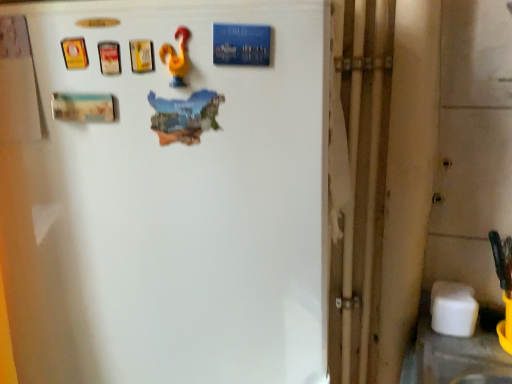
You are a GUI agent. You are given a task and a screenshot of the screen. Output one action in this format:
    pyautogui.click(x=<x>, y=<y>)
    Task: Click on the yellow rubber rooster at upper center
    The height and width of the screenshot is (384, 512).
    Given the screenshot: What is the action you would take?
    pyautogui.click(x=177, y=57)

What do you see at coordinates (177, 57) in the screenshot?
I see `yellow rubber rooster at upper center` at bounding box center [177, 57].

What is the approximate height of yellow rubber rooster at upper center?

yellow rubber rooster at upper center is 3.61 inches tall.

The width and height of the screenshot is (512, 384). Identify the location of white glossy refrigerator at upper center. (165, 191).

Consider the image. Measure the distance between point (141, 308) and camera.

Point (141, 308) and camera are 27.24 inches apart.

This screenshot has width=512, height=384. Describe the element at coordinates (165, 191) in the screenshot. I see `white glossy refrigerator at upper center` at that location.

Identify the location of yellow rubber rooster at upper center. (177, 57).

Is white glossy refrigerator at upper center to the right of yellow rubber rooster at upper center from the viewer's perspective?

No, white glossy refrigerator at upper center is not to the right of yellow rubber rooster at upper center.

Considering their positions, is white glossy refrigerator at upper center located in front of or behind yellow rubber rooster at upper center?

Visually, white glossy refrigerator at upper center is located in front of yellow rubber rooster at upper center.

Does point (189, 67) lie behind point (180, 53)?

Yes.

From the image's perspective, is white glossy refrigerator at upper center over yellow rubber rooster at upper center?

Incorrect, from the image's perspective, white glossy refrigerator at upper center is lower than yellow rubber rooster at upper center.

From a real-world perspective, who is located higher, white glossy refrigerator at upper center or yellow rubber rooster at upper center?

In real-world perspective, yellow rubber rooster at upper center is above.

Which of these two, white glossy refrigerator at upper center or yellow rubber rooster at upper center, is wider?

With larger width is white glossy refrigerator at upper center.

Between white glossy refrigerator at upper center and yellow rubber rooster at upper center, which one has more height?

With more height is white glossy refrigerator at upper center.

Considering the relative sizes of white glossy refrigerator at upper center and yellow rubber rooster at upper center in the image provided, is white glossy refrigerator at upper center bigger than yellow rubber rooster at upper center?

Indeed, white glossy refrigerator at upper center has a larger size compared to yellow rubber rooster at upper center.

Is white glossy refrigerator at upper center situated inside yellow rubber rooster at upper center or outside?

white glossy refrigerator at upper center is located beyond the bounds of yellow rubber rooster at upper center.

Is white glossy refrigerator at upper center beside yellow rubber rooster at upper center?

white glossy refrigerator at upper center and yellow rubber rooster at upper center are clearly separated.

Is white glossy refrigerator at upper center looking in the opposite direction of yellow rubber rooster at upper center?

No.

How many degrees apart are the facing directions of white glossy refrigerator at upper center and yellow rubber rooster at upper center?

0.19 degrees separate the facing orientations of white glossy refrigerator at upper center and yellow rubber rooster at upper center.

Find the location of a particular element. Image resolution: width=512 pixels, height=384 pixels. refrigerator that appears in front of the yellow rubber rooster at upper center is located at coordinates (165, 191).

Which is more to the left, yellow rubber rooster at upper center or white glossy refrigerator at upper center?

From the viewer's perspective, white glossy refrigerator at upper center appears more on the left side.

Considering their positions, is yellow rubber rooster at upper center located in front of or behind white glossy refrigerator at upper center?

yellow rubber rooster at upper center is behind white glossy refrigerator at upper center.

Is point (174, 86) less distant than point (63, 306)?

That is True.

From the image's perspective, which object appears higher, yellow rubber rooster at upper center or white glossy refrigerator at upper center?

yellow rubber rooster at upper center appears higher in the image.

From a real-world perspective, which is physically above, yellow rubber rooster at upper center or white glossy refrigerator at upper center?

From a 3D spatial view, yellow rubber rooster at upper center is above.

Can you confirm if yellow rubber rooster at upper center is thinner than white glossy refrigerator at upper center?

Yes.

Can you confirm if yellow rubber rooster at upper center is shorter than white glossy refrigerator at upper center?

Indeed, yellow rubber rooster at upper center has a lesser height compared to white glossy refrigerator at upper center.

In terms of size, does yellow rubber rooster at upper center appear bigger or smaller than white glossy refrigerator at upper center?

Considering their sizes, yellow rubber rooster at upper center takes up less space than white glossy refrigerator at upper center.

Is yellow rubber rooster at upper center spatially inside white glossy refrigerator at upper center, or outside of it?

yellow rubber rooster at upper center is enclosed within white glossy refrigerator at upper center.

Is yellow rubber rooster at upper center not close to white glossy refrigerator at upper center?

No, yellow rubber rooster at upper center is in close proximity to white glossy refrigerator at upper center.

Is yellow rubber rooster at upper center turned away from white glossy refrigerator at upper center?

Yes, yellow rubber rooster at upper center's orientation is away from white glossy refrigerator at upper center.

Measure the distance between yellow rubber rooster at upper center and white glossy refrigerator at upper center.

The distance of yellow rubber rooster at upper center from white glossy refrigerator at upper center is 10.17 inches.

Where is `refrigerator below the yellow rubber rooster at upper center (from a real-world perspective)`? refrigerator below the yellow rubber rooster at upper center (from a real-world perspective) is located at coordinates (165, 191).

This screenshot has height=384, width=512. I want to click on toy above the white glossy refrigerator at upper center (from the image's perspective), so click(177, 57).

This screenshot has height=384, width=512. I want to click on toy above the white glossy refrigerator at upper center (from a real-world perspective), so click(177, 57).